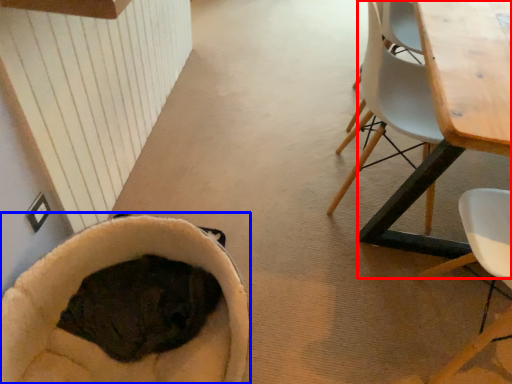
Question: Which of the following is the closest to the observer, table (highlighted by a red box) or bean bag chair (highlighted by a blue box)?

Choices:
 (A) table
 (B) bean bag chair

Answer: (A)